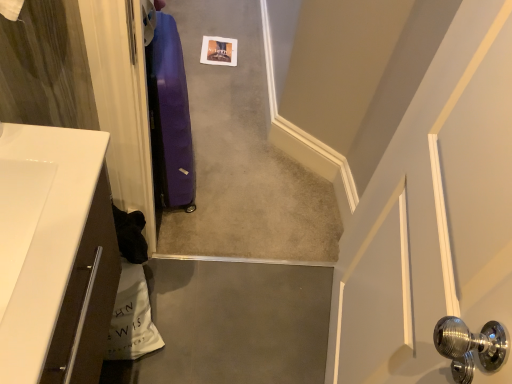
Question: Should I look upward or downward to see white glossy countertop at lower left?

Choices:
 (A) up
 (B) down

Answer: (B)

Question: Should I look upward or downward to see purple fabric suitcase at center?

Choices:
 (A) up
 (B) down

Answer: (A)

Question: Is purple fabric suitcase at left far away from white glossy countertop at lower left?

Choices:
 (A) no
 (B) yes

Answer: (A)

Question: Is purple fabric suitcase at left smaller than white glossy countertop at lower left?

Choices:
 (A) yes
 (B) no

Answer: (B)

Question: From the image's perspective, does purple fabric suitcase at left appear lower than white glossy countertop at lower left?

Choices:
 (A) no
 (B) yes

Answer: (A)

Question: Can you see purple fabric suitcase at left touching white glossy countertop at lower left?

Choices:
 (A) yes
 (B) no

Answer: (B)

Question: Does purple fabric suitcase at left have a greater width compared to white glossy countertop at lower left?

Choices:
 (A) no
 (B) yes

Answer: (A)

Question: Is purple fabric suitcase at left at the left side of white glossy countertop at lower left?

Choices:
 (A) yes
 (B) no

Answer: (B)

Question: Does white glossy countertop at lower left touch purple fabric suitcase at center?

Choices:
 (A) no
 (B) yes

Answer: (A)

Question: Does white glossy countertop at lower left have a larger size compared to purple fabric suitcase at center?

Choices:
 (A) yes
 (B) no

Answer: (B)

Question: Does white glossy countertop at lower left have a lesser width compared to purple fabric suitcase at center?

Choices:
 (A) yes
 (B) no

Answer: (A)

Question: From a real-world perspective, is white glossy countertop at lower left located beneath purple fabric suitcase at center?

Choices:
 (A) yes
 (B) no

Answer: (B)

Question: Considering the relative sizes of white glossy countertop at lower left and purple fabric suitcase at center in the image provided, is white glossy countertop at lower left taller than purple fabric suitcase at center?

Choices:
 (A) no
 (B) yes

Answer: (B)

Question: Is white glossy countertop at lower left shorter than purple fabric suitcase at center?

Choices:
 (A) yes
 (B) no

Answer: (B)

Question: Does purple fabric suitcase at center have a lesser height compared to purple fabric suitcase at left?

Choices:
 (A) no
 (B) yes

Answer: (B)